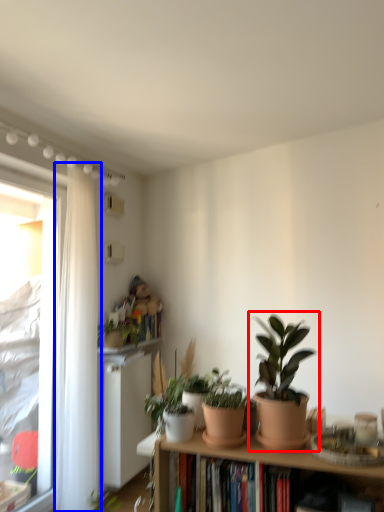
Question: Among these objects, which one is nearest to the camera, houseplant (highlighted by a red box) or curtain (highlighted by a blue box)?

Choices:
 (A) houseplant
 (B) curtain

Answer: (A)